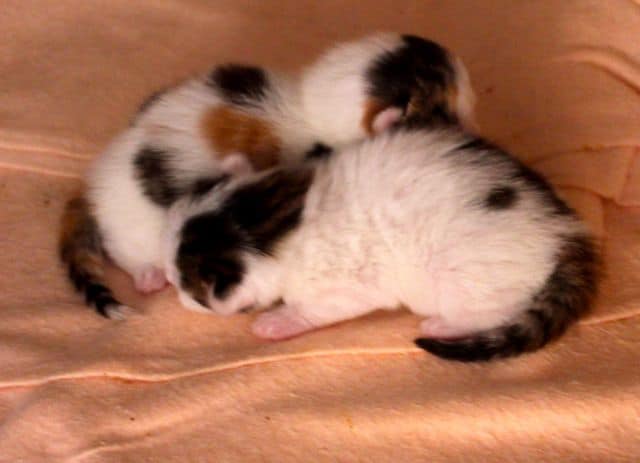
Where is `spot on blanket`? The height and width of the screenshot is (463, 640). spot on blanket is located at coordinates (45, 201), (490, 91).